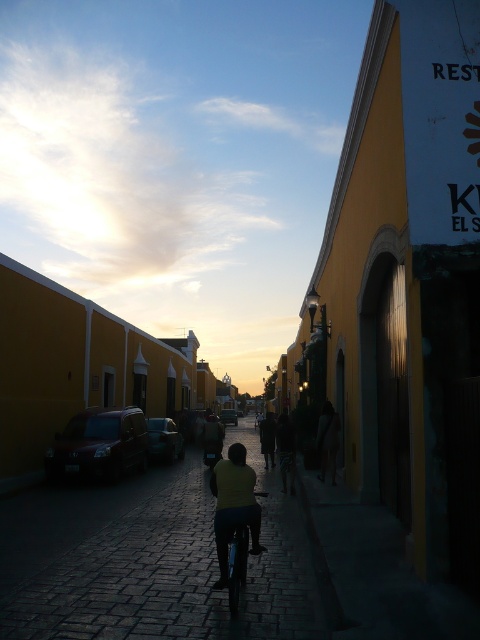
From the picture: Between dark cobblestone alley at center and dark fabric bag at center, which one is positioned lower?

dark cobblestone alley at center

Which is above, dark cobblestone alley at center or dark fabric bag at center?

Positioned higher is dark fabric bag at center.

Does point (131, 497) come behind point (328, 422)?

No, (131, 497) is closer to viewer.

This screenshot has height=640, width=480. What are the coordinates of `dark cobblestone alley at center` in the screenshot? It's located at (151, 561).

From the picture: Can you confirm if dark cobblestone alley at center is smaller than dark yellow shirt at center?

No, dark cobblestone alley at center is not smaller than dark yellow shirt at center.

From the picture: Is dark cobblestone alley at center above dark yellow shirt at center?

Incorrect, dark cobblestone alley at center is not positioned above dark yellow shirt at center.

I want to click on dark cobblestone alley at center, so click(151, 561).

Locate an element on the screen. Image resolution: width=480 pixels, height=640 pixels. dark cobblestone alley at center is located at coordinates (151, 561).

Which is in front, point (211, 476) or point (336, 433)?

Point (336, 433) is more forward.

Which is more to the left, dark yellow shirt at center or dark fabric bag at center?

Positioned to the left is dark yellow shirt at center.

Which is in front, point (215, 525) or point (324, 465)?

Point (215, 525)

You are a GUI agent. You are given a task and a screenshot of the screen. Output one action in this format:
    pyautogui.click(x=<x>, y=<y>)
    Task: Click on the dark yellow shirt at center
    
    Given the screenshot: What is the action you would take?
    pyautogui.click(x=233, y=506)